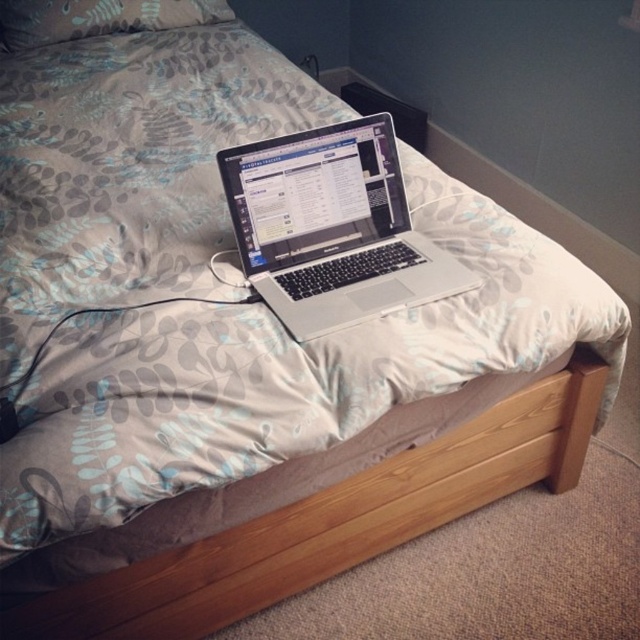
Question: Which of the following is the farthest from the observer?

Choices:
 (A) (260, 554)
 (B) (19, 24)

Answer: (B)

Question: Which point is farther to the camera?

Choices:
 (A) gray fabric pillow at upper center
 (B) silver metallic laptop at center
 (C) wooden bed frame at lower center

Answer: (A)

Question: Does wooden bed frame at lower center appear over silver metallic laptop at center?

Choices:
 (A) yes
 (B) no

Answer: (B)

Question: Among these objects, which one is farthest from the camera?

Choices:
 (A) wooden bed frame at lower center
 (B) silver metallic laptop at center

Answer: (B)

Question: Is wooden bed frame at lower center to the left of silver metallic laptop at center from the viewer's perspective?

Choices:
 (A) yes
 (B) no

Answer: (B)

Question: Does wooden bed frame at lower center appear over silver metallic laptop at center?

Choices:
 (A) yes
 (B) no

Answer: (B)